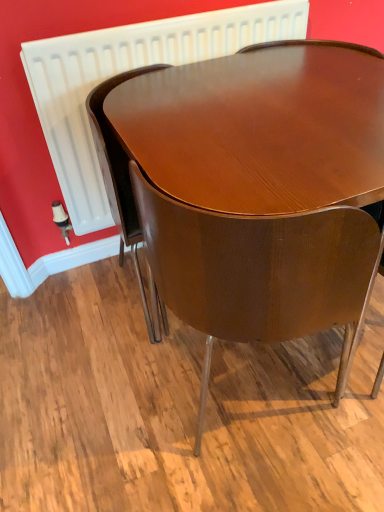
Locate an element on the screen. The image size is (384, 512). free spot in front of glossy wood chair at center, which appears as the first chair when viewed from the right is located at coordinates click(263, 473).